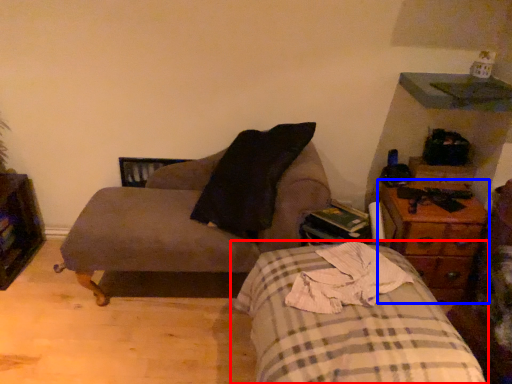
Question: Which point is further to the camera, bed (highlighted by a red box) or nightstand (highlighted by a blue box)?

Choices:
 (A) bed
 (B) nightstand

Answer: (B)